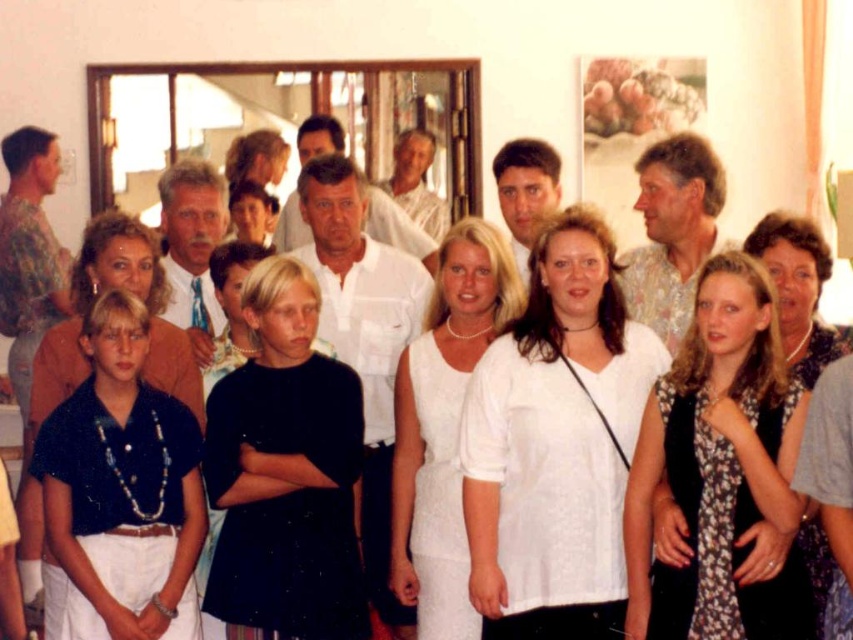
Question: Does floral dress at center have a greater width compared to black matte dress at center?

Choices:
 (A) yes
 (B) no

Answer: (B)

Question: Which point is closer to the camera taking this photo?

Choices:
 (A) (360, 628)
 (B) (41, 554)
 (C) (410, 90)

Answer: (A)

Question: Which object is the closest to the floral dress at center?

Choices:
 (A) white lace dress at center
 (B) dark blue shirt at center

Answer: (A)

Question: Which object is positioned farthest from the white lace dress at center?

Choices:
 (A) dark blue shirt at center
 (B) floral dress at center
 (C) matte glass mirror at center

Answer: (C)

Question: Is white lace blouse at center above white lace dress at center?

Choices:
 (A) yes
 (B) no

Answer: (A)

Question: Is white lace dress at center closer to the viewer compared to dark blue shirt at center?

Choices:
 (A) yes
 (B) no

Answer: (A)